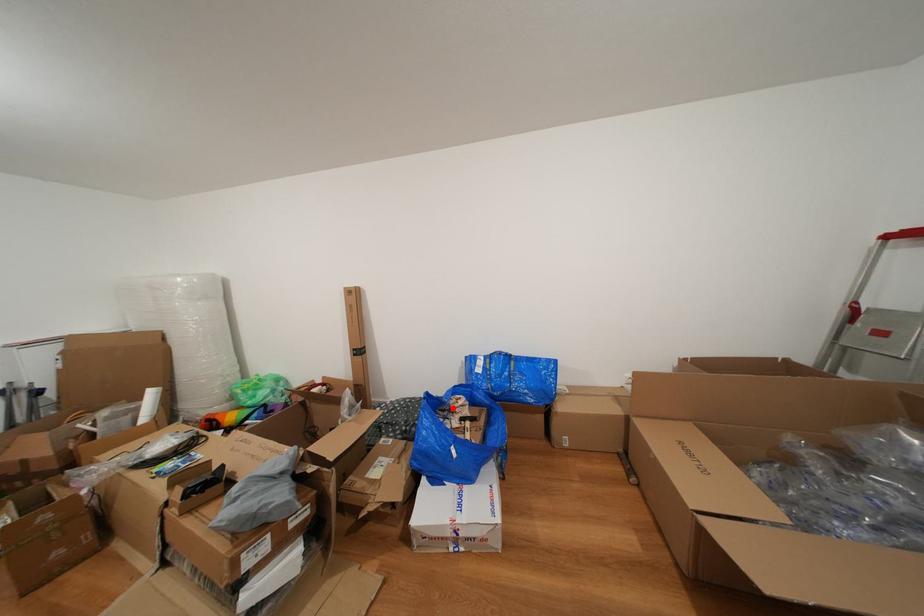
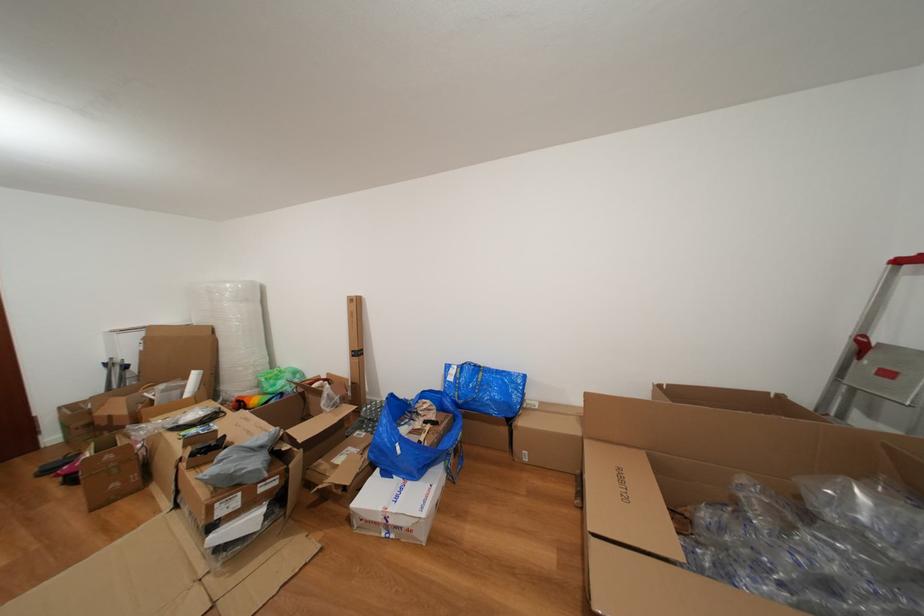
Locate, in the second image, the point that corresponds to the highlighted location in the first image.

(418, 410)